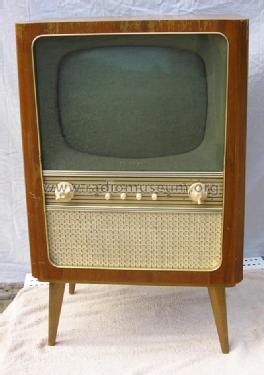
You are a GUI agent. You are given a task and a screenshot of the screen. Output one action in this format:
    pyautogui.click(x=<x>, y=<y>)
    Task: Click on the wall
    This screenshot has height=375, width=264.
    Given the screenshot: What is the action you would take?
    pyautogui.click(x=10, y=200)